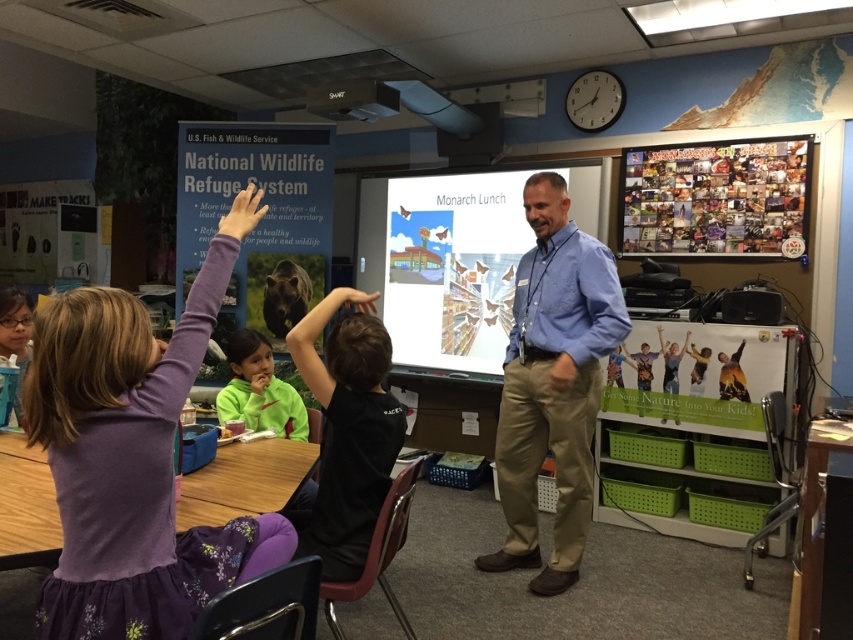
Question: Which point is closer to the camera?

Choices:
 (A) blue shirt at center
 (B) purple fabric dress at left
 (C) green fleece jacket at center

Answer: (B)

Question: Which of the following is the closest to the observer?

Choices:
 (A) black shirt at center
 (B) multicolored collage at upper right
 (C) purple fabric dress at left
 (D) black plastic projector at upper center

Answer: (C)

Question: Does black shirt at center appear on the left side of multicolored collage at upper right?

Choices:
 (A) yes
 (B) no

Answer: (A)

Question: Does purple fabric dress at left lie behind green fleece jacket at center?

Choices:
 (A) yes
 (B) no

Answer: (B)

Question: Which object appears farthest from the camera in this image?

Choices:
 (A) multicolored collage at upper right
 (B) green fleece jacket at center

Answer: (A)

Question: Does multicolored collage at upper right appear on the right side of green fleece jacket at center?

Choices:
 (A) no
 (B) yes

Answer: (B)